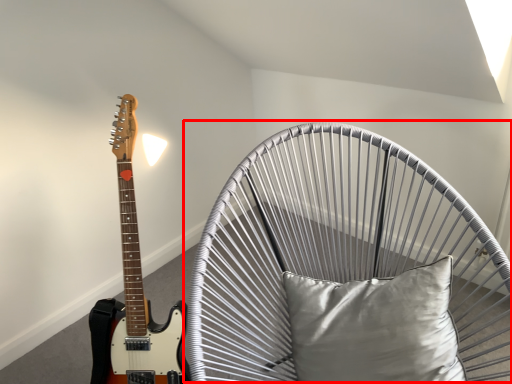
Question: From the image's perspective, what is the correct spatial relationship of swivel chair (annotated by the red box) in relation to pillow?

Choices:
 (A) above
 (B) below

Answer: (B)